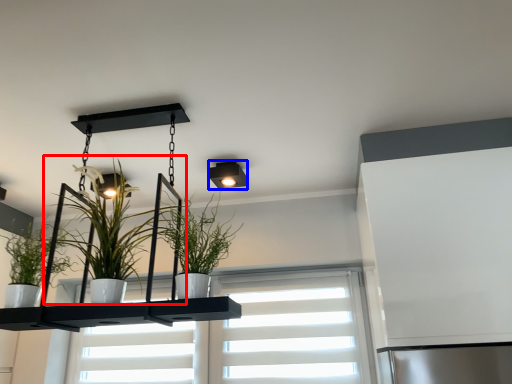
Question: Which object appears farthest to the camera in this image, houseplant (highlighted by a red box) or light fixture (highlighted by a blue box)?

Choices:
 (A) houseplant
 (B) light fixture

Answer: (B)